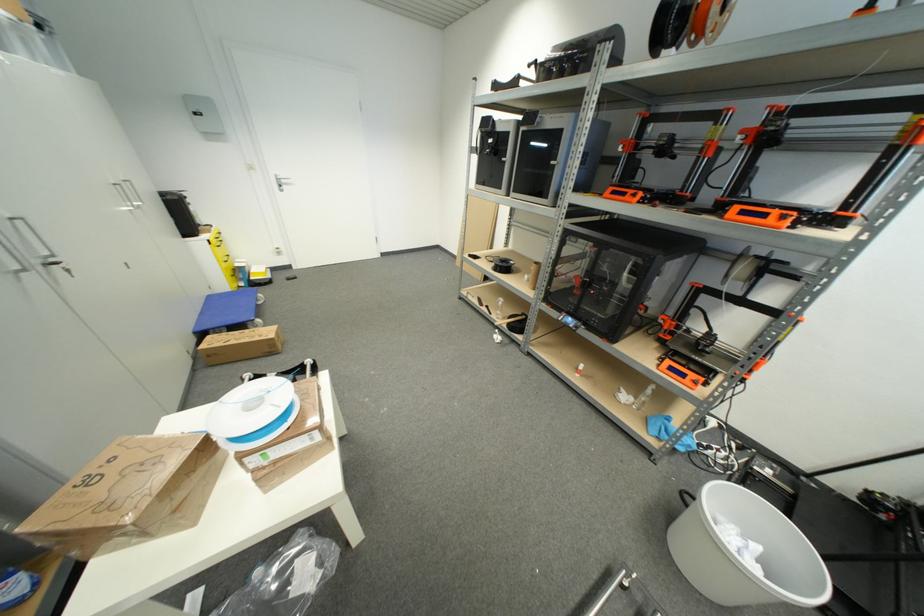
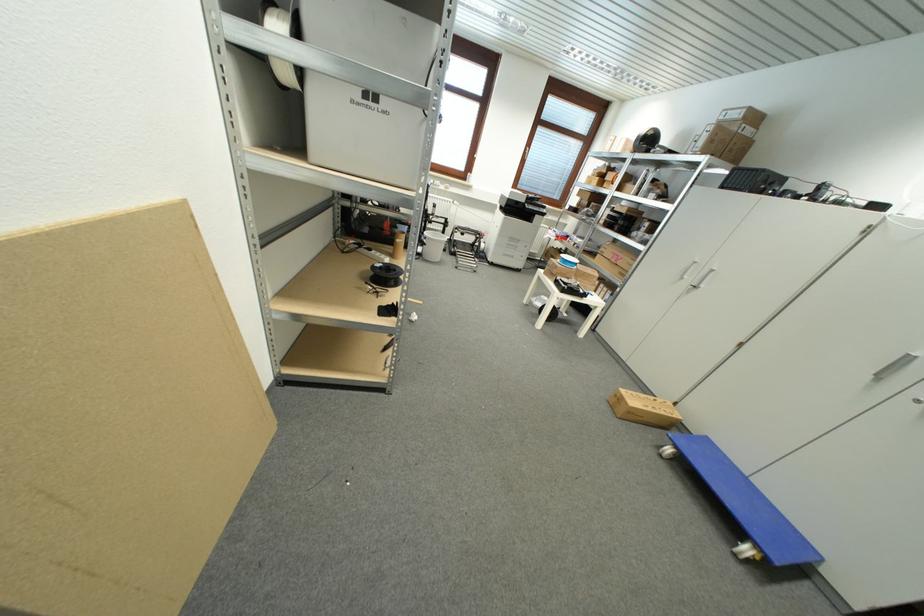
Question: I am providing you with two images of the same scene from different viewpoints. Which of the following objects are not visible in image2?

Choices:
 (A) silver cabinet handle
 (B) cardboard box
 (C) yellow-lid jar
 (D) orange control screen

Answer: (D)